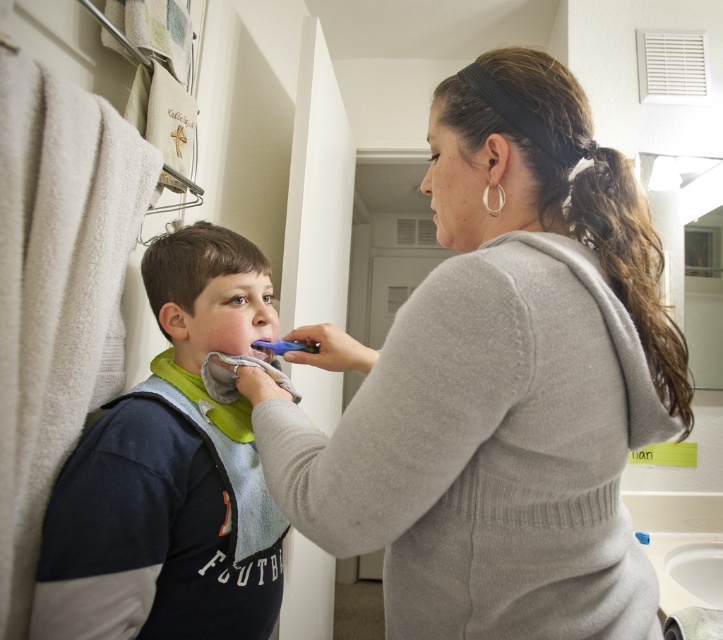
Which is behind, point (549, 209) or point (286, 344)?

The point (286, 344) is more distant.

Is point (455, 188) closer to viewer compared to point (304, 349)?

That is True.

Is point (586, 392) less distant than point (286, 349)?

That is True.

At what (x,y) coordinates should I click in order to perform the action: click on matte gray sweater at center. Please return your answer as a coordinate pair (x, y). Looking at the image, I should click on (500, 381).

Is point (630, 586) farther from viewer compared to point (435, 225)?

No, (630, 586) is closer to viewer.

Locate an element on the screen. The image size is (723, 640). matte gray sweater at center is located at coordinates (500, 381).

Which is behind, point (341, 531) or point (432, 205)?

The point (432, 205) is behind.

You are a GUI agent. You are given a task and a screenshot of the screen. Output one action in this format:
    pyautogui.click(x=<x>, y=<y>)
    Task: Click on the matte gray sweater at center
    This screenshot has height=640, width=723.
    Given the screenshot: What is the action you would take?
    pyautogui.click(x=500, y=381)

Does dark blue cotton shirt at left have a lesser height compared to smooth skin at center?

Incorrect, dark blue cotton shirt at left's height does not fall short of smooth skin at center's.

Does dark blue cotton shirt at left have a greater width compared to smooth skin at center?

Correct, the width of dark blue cotton shirt at left exceeds that of smooth skin at center.

Is point (171, 614) positioned before point (437, 211)?

That is False.

The width and height of the screenshot is (723, 640). Find the location of `dark blue cotton shirt at left`. dark blue cotton shirt at left is located at coordinates (171, 474).